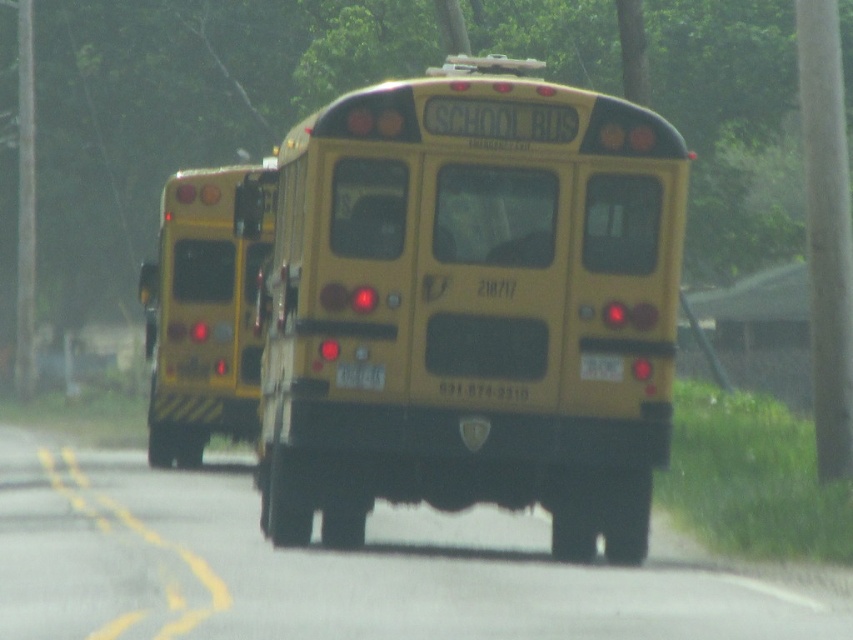
Is yellow matte school bus at center further to the viewer compared to yellow matte school bus at left?

No, it is not.

Consider the image. Who is lower down, yellow matte school bus at center or yellow matte school bus at left?

Positioned lower is yellow matte school bus at center.

Measure the distance between point (584,387) and camera.

Point (584,387) is 14.42 meters away from camera.

The image size is (853, 640). Find the location of `yellow matte school bus at center`. yellow matte school bus at center is located at coordinates (473, 307).

Measure the distance from yellow matte school bus at left to yellow matte license plate at center.

They are 4.81 meters apart.

This screenshot has width=853, height=640. In order to click on yellow matte school bus at left in this screenshot , I will do `click(202, 314)`.

Which is in front, point (666, 308) or point (347, 372)?

Point (347, 372)

Does point (608, 253) lie in front of point (373, 376)?

No, (608, 253) is behind (373, 376).

Does point (584, 492) lie in front of point (367, 364)?

No.

This screenshot has width=853, height=640. Identify the location of yellow matte school bus at center. (473, 307).